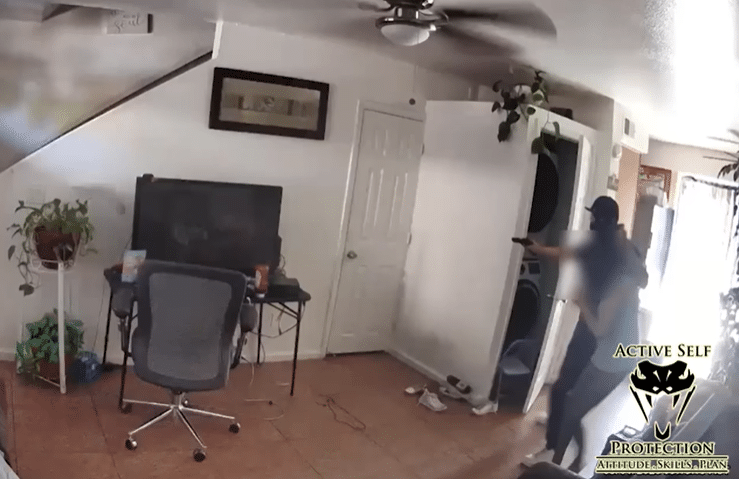
Locate an element on the screen. The width and height of the screenshot is (739, 479). tv is located at coordinates (219, 230).